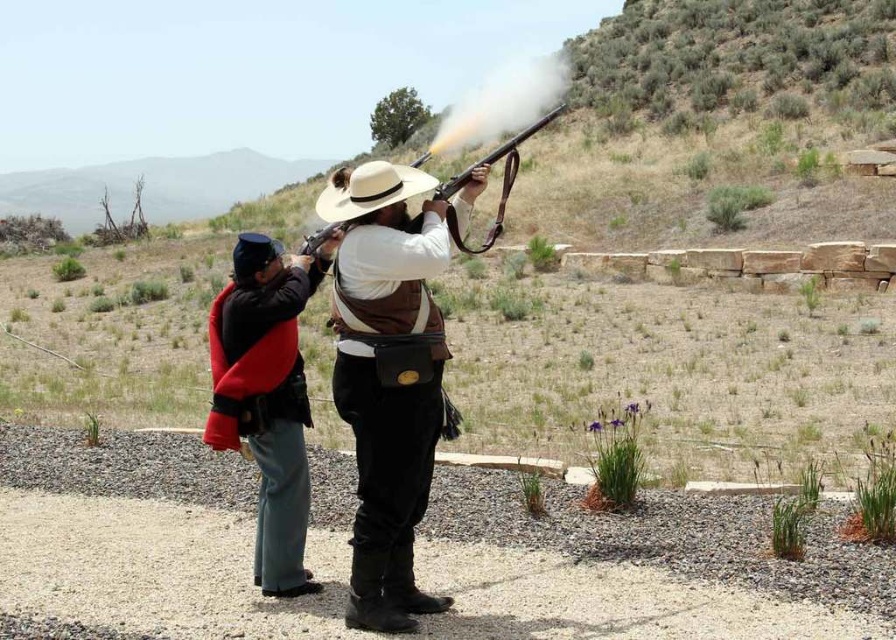
Question: Is red wool coat at center above white felt cowboy hat at center?

Choices:
 (A) no
 (B) yes

Answer: (A)

Question: Estimate the real-world distances between objects in this image. Which object is closer to the brown leather vest at center?

Choices:
 (A) white felt cowboy hat at center
 (B) red wool coat at center
 (C) wooden smooth rifle at center
 (D) matte brown shotgun at center

Answer: (C)

Question: Is brown leather vest at center positioned at the back of red wool coat at center?

Choices:
 (A) yes
 (B) no

Answer: (B)

Question: Is red wool coat at center in front of wooden smooth rifle at center?

Choices:
 (A) yes
 (B) no

Answer: (B)

Question: Which of the following is the closest to the observer?

Choices:
 (A) (454, 186)
 (B) (299, 250)
 (C) (418, 452)

Answer: (C)

Question: Estimate the real-world distances between objects in this image. Which object is closer to the matte brown shotgun at center?

Choices:
 (A) white felt cowboy hat at center
 (B) wooden smooth rifle at center

Answer: (A)